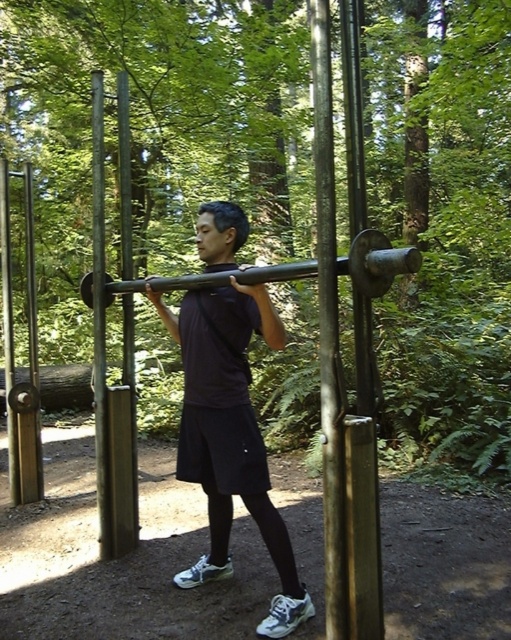
Which is below, brushed metal pole at center or black metal barbell at center?

brushed metal pole at center is lower down.

Is brushed metal pole at center closer to camera compared to black metal barbell at center?

No, brushed metal pole at center is behind black metal barbell at center.

What do you see at coordinates (329, 330) in the screenshot?
I see `brushed metal pole at center` at bounding box center [329, 330].

Locate an element on the screen. The height and width of the screenshot is (640, 511). brushed metal pole at center is located at coordinates (329, 330).

Is matte black shirt at center smaller than black metal barbell at center?

No.

The image size is (511, 640). What do you see at coordinates (229, 435) in the screenshot?
I see `matte black shirt at center` at bounding box center [229, 435].

The width and height of the screenshot is (511, 640). Identify the location of matte black shirt at center. (229, 435).

Is the position of black metal barbell at center less distant than that of polished metal pole at center?

Yes, it is in front of polished metal pole at center.

Measure the distance from black metal barbell at center to polished metal pole at center.

black metal barbell at center and polished metal pole at center are 29.11 inches apart from each other.

The image size is (511, 640). Find the location of `black metal barbell at center`. black metal barbell at center is located at coordinates (377, 262).